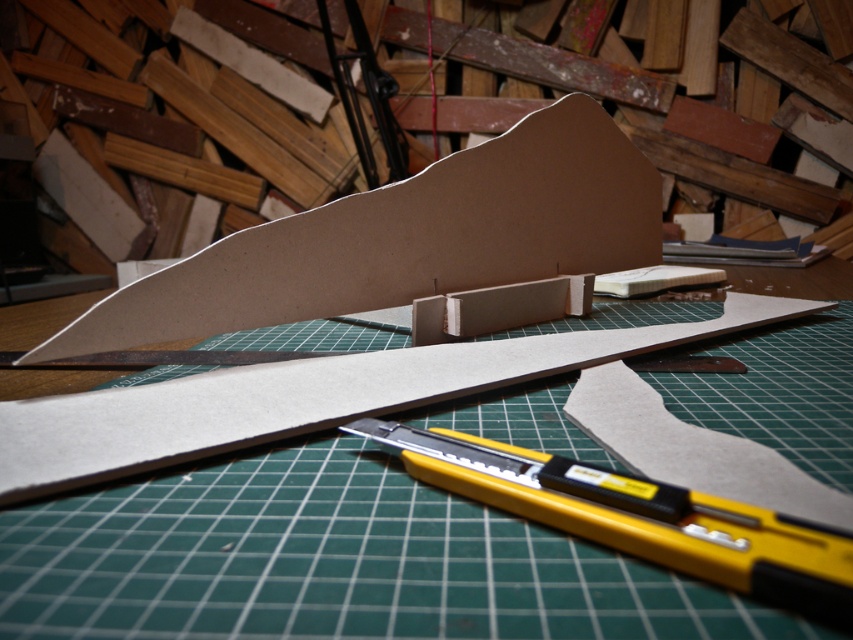
You are a craftsperson working on a project and need to reach the yellow plastic utility knife at center to cut the brown cardboard at center. Which object should you move first to access the knife?

You should move the brown cardboard at center first because it is closer to you than the yellow plastic utility knife at center, blocking access to it.

You are a craftsperson working on a project and need to place a new tool on the workspace. Where should you place it to ensure it is visible and accessible, considering the current arrangement of the green cutting mat at center and brown cardboard at center?

You should place the new tool on the green cutting mat at center since it is in front of the brown cardboard at center, making it more visible and accessible.

You are organizing your workspace and need to place a new tool on the green cutting mat at center. To ensure safety, you want to move the yellow plastic utility knife at center away from the edge. Which direction should you move the knife to keep it away from the edge while still being on the mat?

Move the yellow plastic utility knife at center to the left side of the green cutting mat at center since the mat is to the right of the knife, meaning the knife is already near the left edge. Moving it further left would place it off the mat. Instead, moving it to the right towards the center of the mat would keep it safely away from the edge.